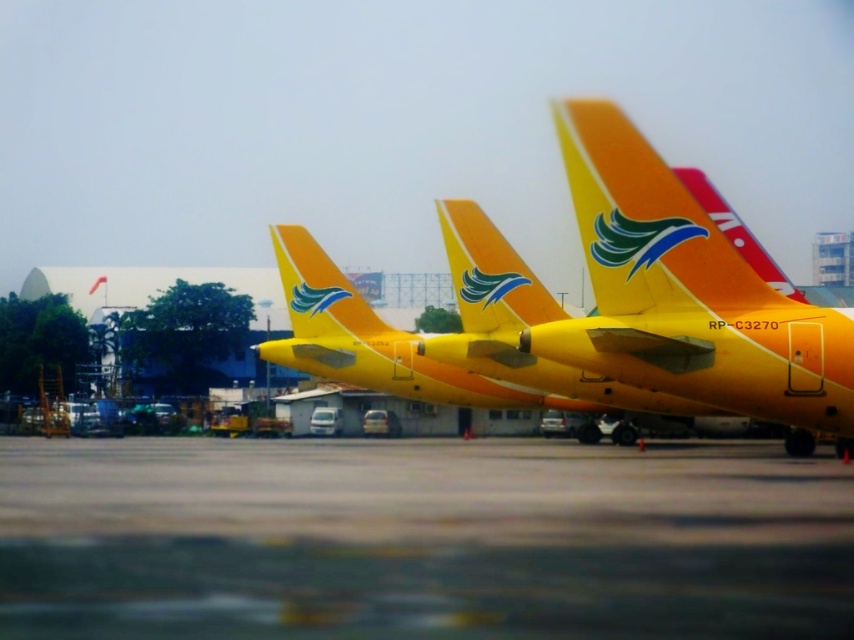
You are a pilot trying to locate the runway. You see the gray concrete tarmac at lower center and the yellow matte airplane at center. Which one is positioned lower in the image?

The gray concrete tarmac at lower center is located below the yellow matte airplane at center, so it is positioned lower in the image.

You are a photographer trying to capture the yellow matte airplane at center on the gray concrete tarmac at lower center. If you want to include both the airplane and the tarmac in your frame, which one should you focus on to ensure both fit in the shot?

The gray concrete tarmac at lower center is wider than the yellow matte airplane at center, so focusing on the airplane while ensuring the tarmac is within the frame would work since the tarmac is wider and can be adjusted to fit alongside the airplane.

You are a maintenance worker needing to reach the yellow matte airplane at center from the gray concrete tarmac at lower center. Can you walk directly to the airplane without any obstacles in between?

The distance between the gray concrete tarmac at lower center and the yellow matte airplane at center is 4.04 meters. Since there are no obstacles mentioned in the scene description, you can walk directly to the airplane.